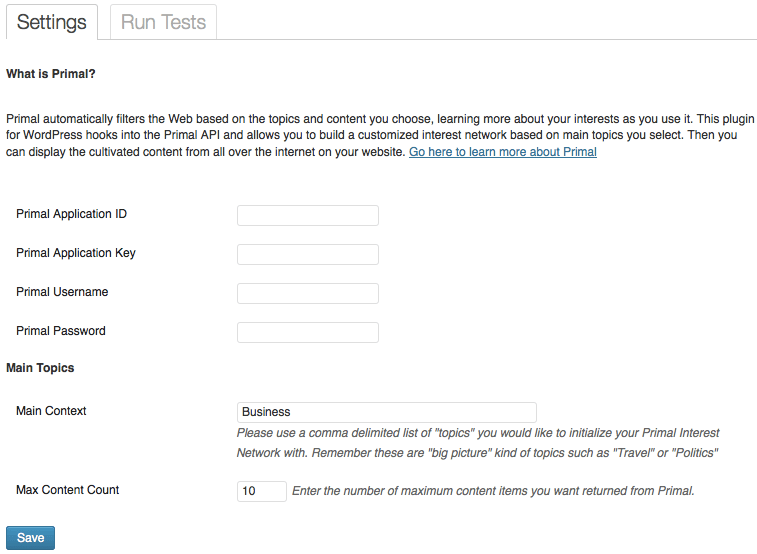
Identify the location of box. The height and width of the screenshot is (554, 757). (26, 529).